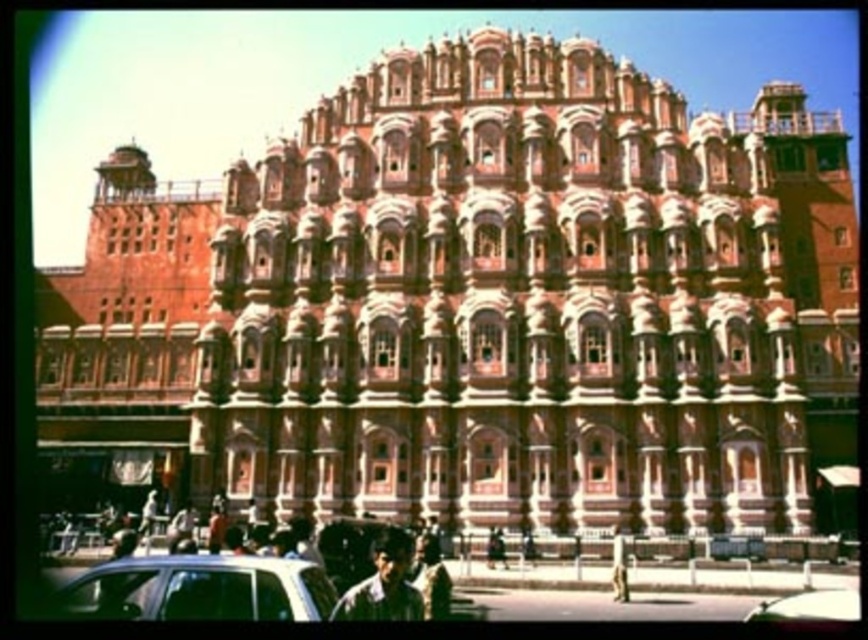
Who is higher up, white glossy car at lower left or metallic silver car at lower center?

white glossy car at lower left is above.

Between point (319, 573) and point (760, 602), which one is positioned in front?

Positioned in front is point (319, 573).

This screenshot has width=868, height=640. What do you see at coordinates (199, 588) in the screenshot?
I see `white glossy car at lower left` at bounding box center [199, 588].

At what (x,y) coordinates should I click in order to perform the action: click on white glossy car at lower left. Please return your answer as a coordinate pair (x, y). Image resolution: width=868 pixels, height=640 pixels. Looking at the image, I should click on (199, 588).